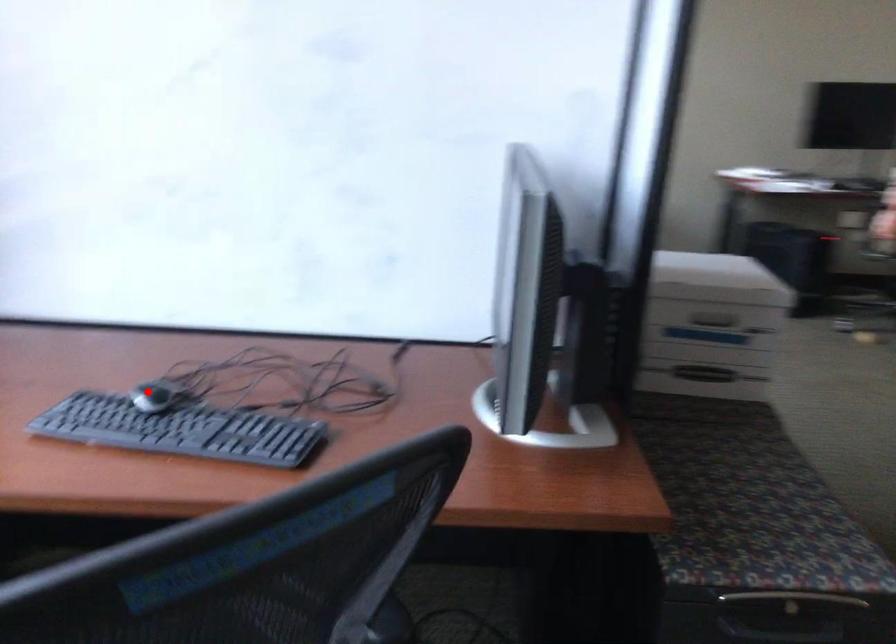
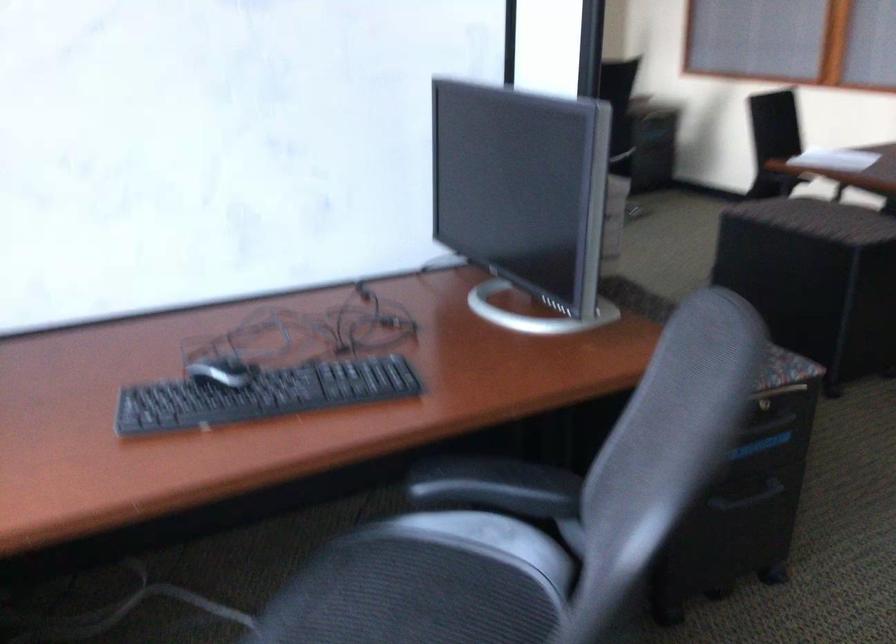
Where in the second image is the point corresponding to the highlighted location from the first image?

(220, 371)